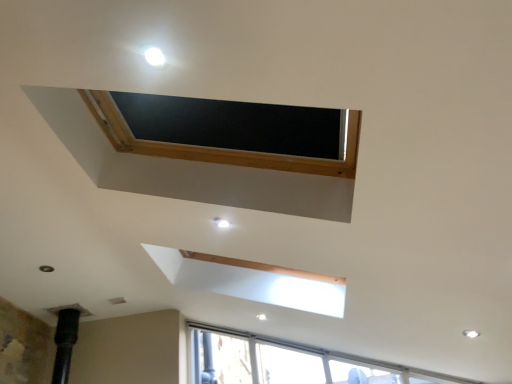
Measure the distance between point (307, 346) and camera.

Point (307, 346) and camera are 3.84 meters apart from each other.

This screenshot has height=384, width=512. What are the coordinates of `transparent glass window at lower center` in the screenshot? It's located at (326, 352).

Describe the element at coordinates (326, 352) in the screenshot. I see `transparent glass window at lower center` at that location.

In order to face transparent glass window at lower center, should I rotate leftwards or rightwards?

Turn right approximately 8.924 degrees to face it.

This screenshot has height=384, width=512. Identify the location of transparent glass window at lower center. (326, 352).